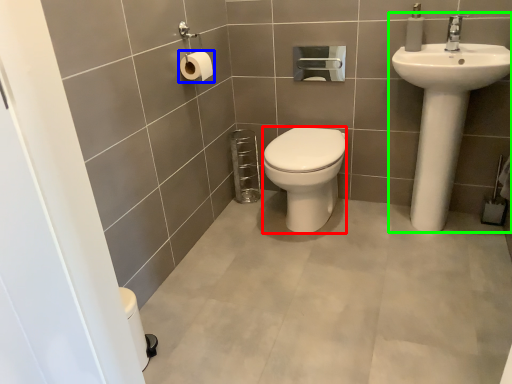
Question: Which is farther away from bidet (highlighted by a red box)? toilet paper (highlighted by a blue box) or sink (highlighted by a green box)?

Choices:
 (A) toilet paper
 (B) sink

Answer: (A)